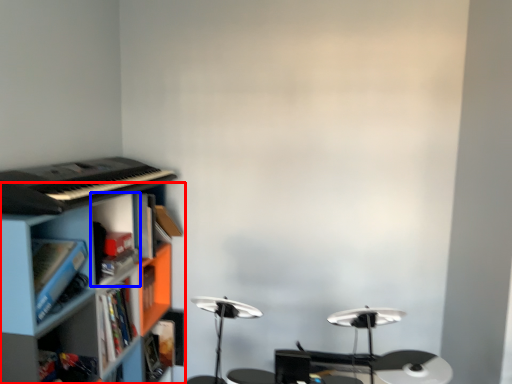
Question: Which point is closer to the camera, shelf (highlighted by a red box) or cabinet (highlighted by a blue box)?

Choices:
 (A) shelf
 (B) cabinet

Answer: (A)